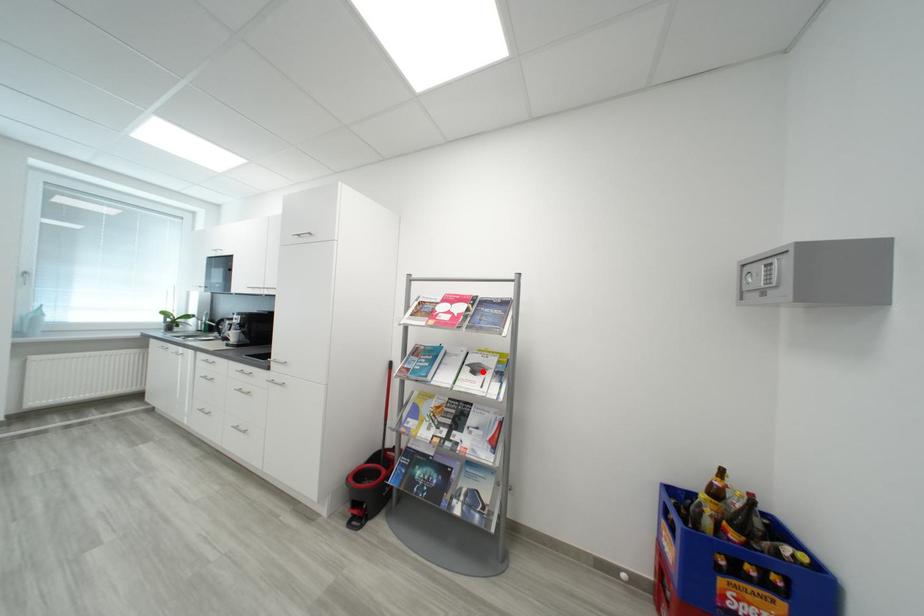
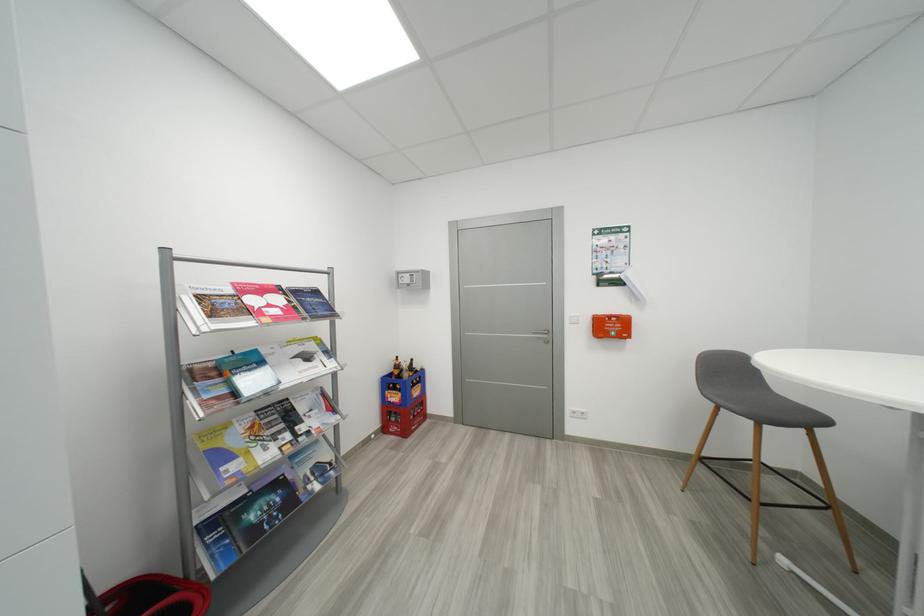
Locate, in the second image, the point that corresponds to the highlighted location in the first image.

(314, 359)